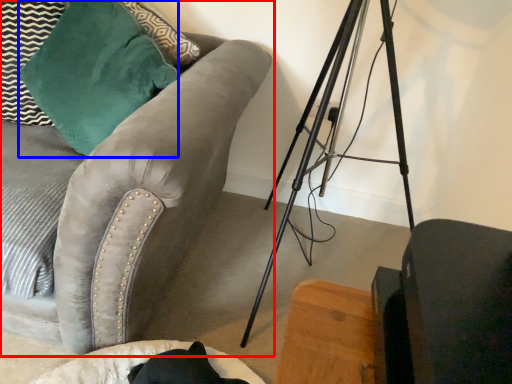
Question: Which object is further to the camera taking this photo, studio couch (highlighted by a red box) or throw pillow (highlighted by a blue box)?

Choices:
 (A) studio couch
 (B) throw pillow

Answer: (B)